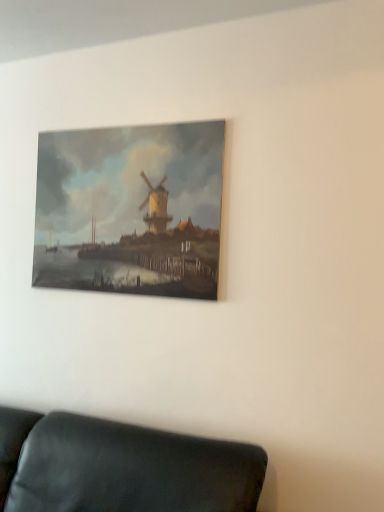
The width and height of the screenshot is (384, 512). I want to click on leather couch at lower left, so click(x=120, y=467).

Describe the element at coordinates (120, 467) in the screenshot. I see `leather couch at lower left` at that location.

What is the approximate width of leather couch at lower left?

leather couch at lower left is 36.30 inches wide.

What is the approximate height of leather couch at lower left?

26.32 inches.

This screenshot has width=384, height=512. Identify the location of leather couch at lower left. (120, 467).